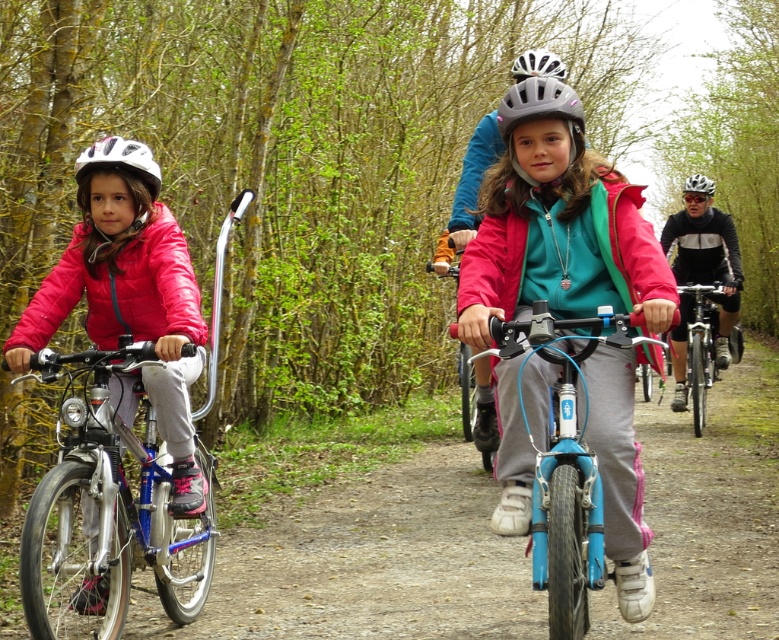
Question: Which object is farther from the camera taking this photo?

Choices:
 (A) brushed metal bicycle at left
 (B) white matte helmet at left

Answer: (B)

Question: Is shiny silver bicycle at right thinner than matte black helmet at center?

Choices:
 (A) no
 (B) yes

Answer: (B)

Question: Is shiny silver bicycle at right wider than gray matte helmet at center?

Choices:
 (A) yes
 (B) no

Answer: (A)

Question: Can you confirm if white matte helmet at center is wider than matte black helmet at center?

Choices:
 (A) yes
 (B) no

Answer: (B)

Question: Which point is farther to the camera?

Choices:
 (A) (520, 99)
 (B) (705, 388)
 (C) (467, 340)
 (D) (603, 536)

Answer: (B)

Question: Estimate the real-world distances between objects in this image. Which object is farther from the matte pink jacket at center?

Choices:
 (A) white matte helmet at left
 (B) blue matte bicycle at center
 (C) white matte helmet at center

Answer: (C)